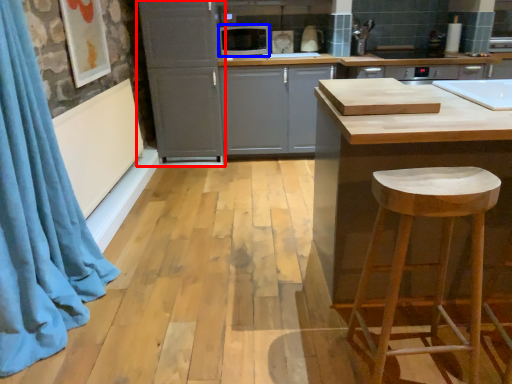
Question: Which point is further to the camera, cabinetry (highlighted by a red box) or appliance (highlighted by a blue box)?

Choices:
 (A) cabinetry
 (B) appliance

Answer: (B)